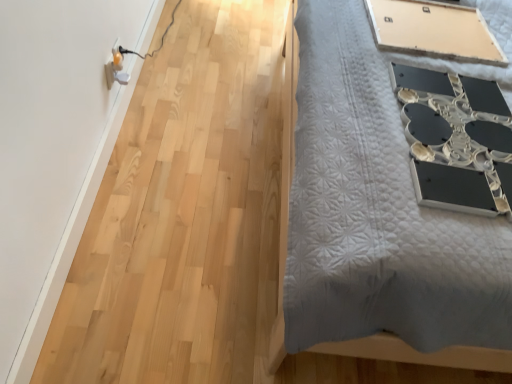
Question: Considering the positions of white plastic electric outlet at upper left and matte beige board at upper right in the image, is white plastic electric outlet at upper left taller or shorter than matte beige board at upper right?

Choices:
 (A) tall
 (B) short

Answer: (A)

Question: Is white plastic electric outlet at upper left bigger or smaller than matte beige board at upper right?

Choices:
 (A) big
 (B) small

Answer: (B)

Question: Is white plastic electric outlet at upper left in front of or behind matte beige board at upper right in the image?

Choices:
 (A) behind
 (B) front

Answer: (A)

Question: In terms of height, does matte beige board at upper right look taller or shorter compared to white plastic electric outlet at upper left?

Choices:
 (A) tall
 (B) short

Answer: (B)

Question: From the image's perspective, is matte beige board at upper right above or below white plastic electric outlet at upper left?

Choices:
 (A) below
 (B) above

Answer: (B)

Question: In the image, is matte beige board at upper right positioned in front of or behind white plastic electric outlet at upper left?

Choices:
 (A) front
 (B) behind

Answer: (A)

Question: Do you think matte beige board at upper right is within white plastic electric outlet at upper left, or outside of it?

Choices:
 (A) outside
 (B) inside

Answer: (A)